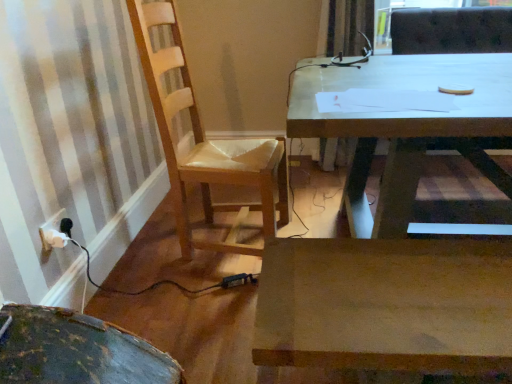
Question: From a real-world perspective, is wooden chair at left beneath wooden desk at center?

Choices:
 (A) yes
 (B) no

Answer: (B)

Question: Can you confirm if wooden chair at left is positioned to the right of wooden desk at center?

Choices:
 (A) no
 (B) yes

Answer: (A)

Question: Does wooden chair at left have a lesser width compared to wooden desk at center?

Choices:
 (A) no
 (B) yes

Answer: (B)

Question: Are wooden chair at left and wooden desk at center far apart?

Choices:
 (A) yes
 (B) no

Answer: (B)

Question: Is the depth of wooden chair at left greater than that of wooden desk at center?

Choices:
 (A) yes
 (B) no

Answer: (A)

Question: Can you confirm if wooden chair at left is taller than wooden desk at center?

Choices:
 (A) no
 (B) yes

Answer: (B)

Question: Is wooden chair at left at the right side of white plastic electrical outlet at lower left?

Choices:
 (A) yes
 (B) no

Answer: (A)

Question: Are wooden chair at left and white plastic electrical outlet at lower left located far from each other?

Choices:
 (A) yes
 (B) no

Answer: (B)

Question: Considering the relative sizes of wooden chair at left and white plastic electrical outlet at lower left in the image provided, is wooden chair at left taller than white plastic electrical outlet at lower left?

Choices:
 (A) yes
 (B) no

Answer: (A)

Question: Is wooden chair at left oriented towards white plastic electrical outlet at lower left?

Choices:
 (A) no
 (B) yes

Answer: (A)

Question: From the image's perspective, is wooden chair at left over white plastic electrical outlet at lower left?

Choices:
 (A) yes
 (B) no

Answer: (A)

Question: From the image's perspective, would you say wooden chair at left is shown under white plastic electrical outlet at lower left?

Choices:
 (A) no
 (B) yes

Answer: (A)

Question: Is white plastic electrical outlet at lower left at the right side of wooden chair at left?

Choices:
 (A) yes
 (B) no

Answer: (B)